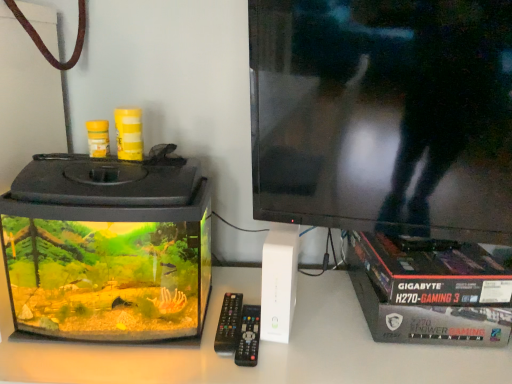
Question: From the image's perspective, is black plastic remote at center positioned above or below transparent glass aquarium at left?

Choices:
 (A) above
 (B) below

Answer: (B)

Question: Is black plastic remote at center inside the boundaries of transparent glass aquarium at left, or outside?

Choices:
 (A) outside
 (B) inside

Answer: (A)

Question: Is black plastic remote at center in front of or behind transparent glass aquarium at left in the image?

Choices:
 (A) front
 (B) behind

Answer: (B)

Question: Do you think transparent glass aquarium at left is within black plastic remote at center, or outside of it?

Choices:
 (A) inside
 (B) outside

Answer: (B)

Question: Is transparent glass aquarium at left taller or shorter than black plastic remote at center?

Choices:
 (A) short
 (B) tall

Answer: (B)

Question: From a real-world perspective, is transparent glass aquarium at left physically located above or below black plastic remote at center?

Choices:
 (A) below
 (B) above

Answer: (B)

Question: In the image, is transparent glass aquarium at left on the left side or the right side of black plastic remote at center?

Choices:
 (A) left
 (B) right

Answer: (A)